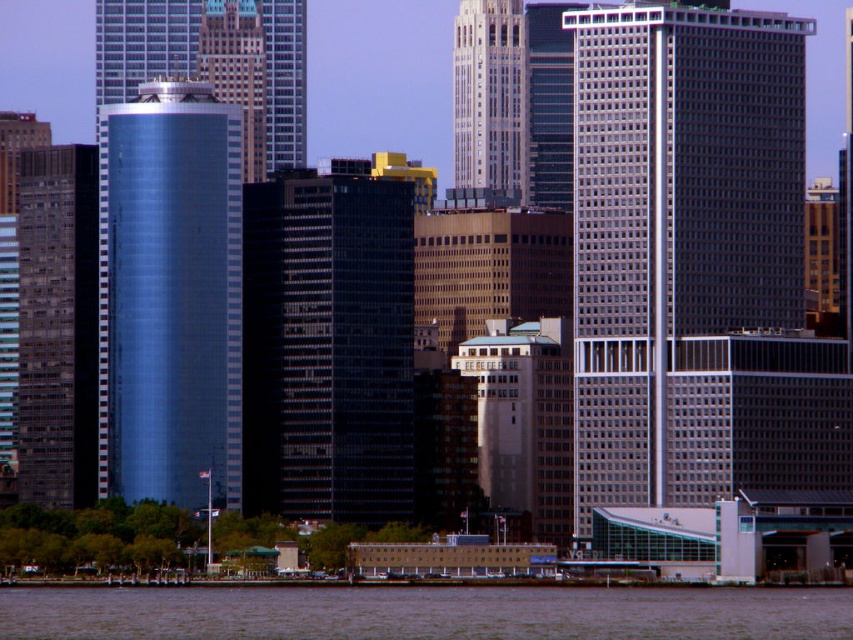
Based on the photo, you are a drone operator trying to capture a photo of the cityscape. Your drone is currently at the coordinates given in the image. You need to adjust your camera to focus on the brown water at lower center. What are the exact coordinates where you should direct your camera?

The exact coordinates for the brown water at lower center are point (425, 611).